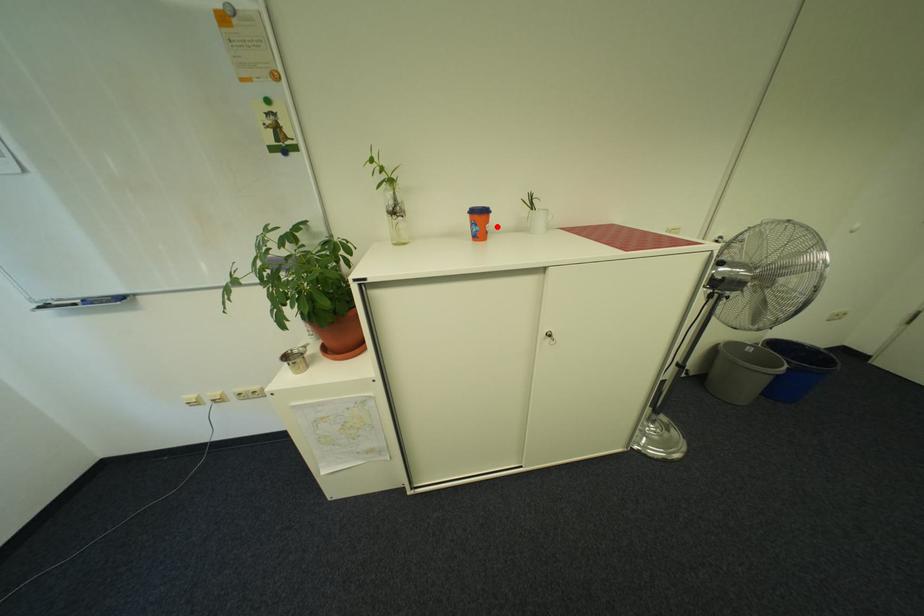
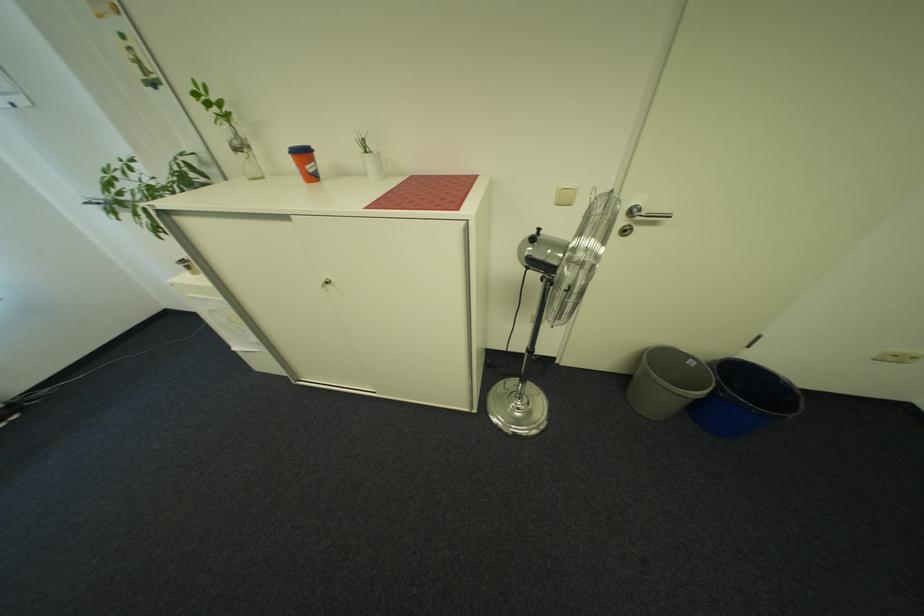
Locate, in the second image, the point that corresponds to the highlighted location in the first image.

(317, 168)